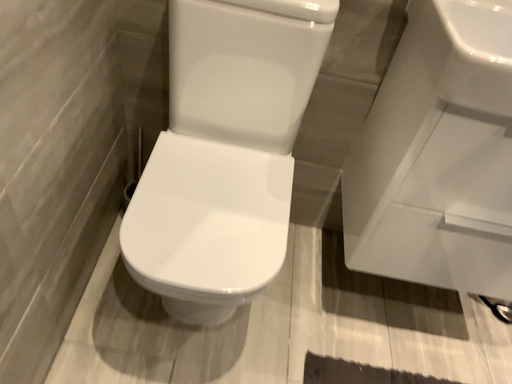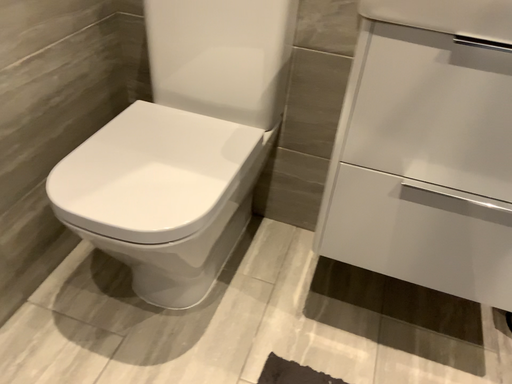
Question: How did the camera likely rotate when shooting the video?

Choices:
 (A) rotated downward
 (B) rotated upward

Answer: (B)